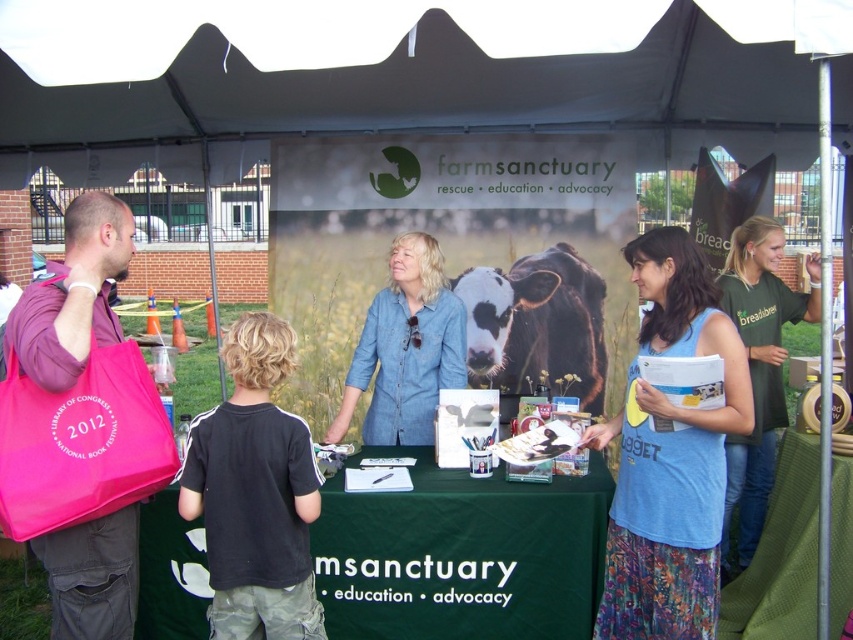
Which is in front, point (426, 122) or point (622, 525)?

Point (622, 525) is in front.

In order to click on white fabric canopy at upper center in this screenshot , I will do `click(402, 65)`.

Can you confirm if white fabric canopy at upper center is taller than green jersey at right?

No.

Between white fabric canopy at upper center and green jersey at right, which one is positioned higher?

Positioned higher is white fabric canopy at upper center.

I want to click on white fabric canopy at upper center, so [402, 65].

In order to click on white fabric canopy at upper center in this screenshot , I will do `click(402, 65)`.

Who is more forward, (619, 513) or (751, 336)?

Point (619, 513)

From the picture: Is blue cotton tank top at center to the left of green jersey at right from the viewer's perspective?

Yes, blue cotton tank top at center is to the left of green jersey at right.

Which is behind, point (717, 548) or point (759, 301)?

The point (759, 301) is more distant.

Find the location of a particular element. blue cotton tank top at center is located at coordinates tap(670, 456).